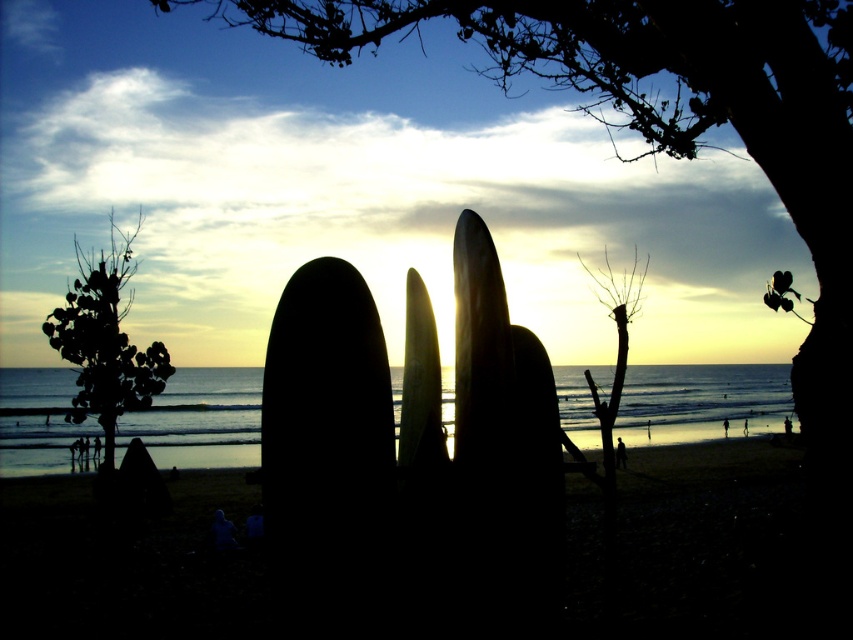
Question: Can you confirm if dark green leafy tree at center is smaller than black matte surfboard at center?

Choices:
 (A) no
 (B) yes

Answer: (A)

Question: Is dark green leafy tree at center positioned before green leafy tree at left?

Choices:
 (A) no
 (B) yes

Answer: (A)

Question: Can you confirm if dark sand at lower center is positioned above black matte surfboard at center?

Choices:
 (A) no
 (B) yes

Answer: (A)

Question: Which point is farther to the camera?

Choices:
 (A) dark sand at lower center
 (B) glossy wood surfboard at center
 (C) dark green leafy tree at center

Answer: (C)

Question: Based on their relative distances, which object is farther from the glossy wood surfboard at center?

Choices:
 (A) dark green leafy tree at center
 (B) shiny yellow surfboard at center
 (C) black matte surfboard at center
 (D) green leafy tree at left

Answer: (A)

Question: Among these objects, which one is nearest to the camera?

Choices:
 (A) green leafy tree at left
 (B) dark sand at lower center
 (C) shiny yellow surfboard at center

Answer: (C)